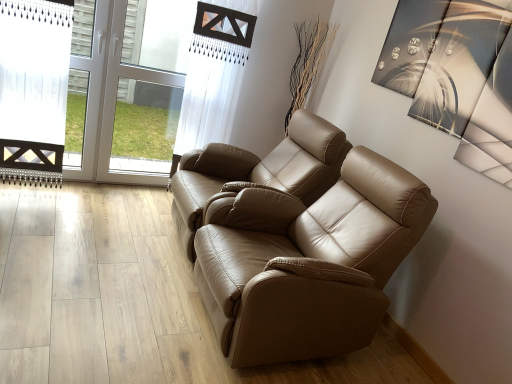
Question: Is point (182, 79) positioned closer to the camera than point (177, 211)?

Choices:
 (A) farther
 (B) closer

Answer: (A)

Question: Relative to tan leather sofa at center, the first chair when ordered from back to front, is transparent glass door at upper left in front or behind?

Choices:
 (A) front
 (B) behind

Answer: (B)

Question: Which is nearer to the tan leather sofa at center, which is the 1th chair from front to back?

Choices:
 (A) tan leather sofa at center, the first chair when ordered from back to front
 (B) transparent glass door at upper left

Answer: (A)

Question: Which object is the farthest from the tan leather sofa at center, arranged as the second chair when viewed from the front?

Choices:
 (A) transparent glass door at upper left
 (B) tan leather sofa at center, which is the second chair in back-to-front order

Answer: (A)